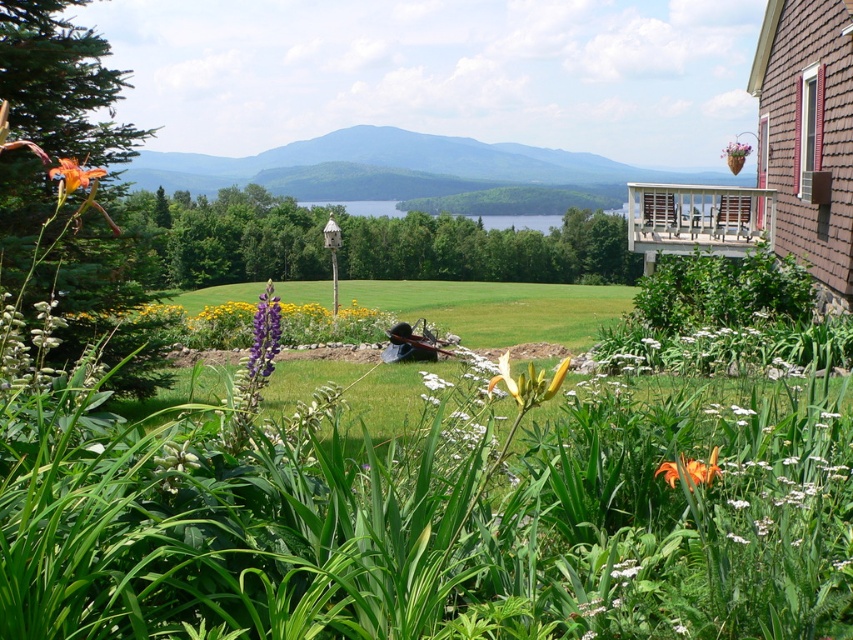
Between point (149, 618) and point (717, 212), which one is positioned behind?

The point (717, 212) is behind.

Can you confirm if green leafy plants at center is positioned below wooden deck at upper right?

Correct, green leafy plants at center is located below wooden deck at upper right.

Is point (581, 545) closer to camera compared to point (767, 198)?

Yes, it is in front of point (767, 198).

Where is `green leafy plants at center`? The image size is (853, 640). green leafy plants at center is located at coordinates (428, 515).

Between wooden deck at upper right and matte plastic hanging basket at upper right, which one appears on the right side from the viewer's perspective?

matte plastic hanging basket at upper right is more to the right.

Which of these two, wooden deck at upper right or matte plastic hanging basket at upper right, stands shorter?

wooden deck at upper right is shorter.

Measure the distance between point (761,214) and camera.

Point (761,214) and camera are 18.47 meters apart.

Where is `wooden deck at upper right`? This screenshot has height=640, width=853. wooden deck at upper right is located at coordinates (698, 218).

Is yellow matte flower at center smaller than matte plastic hanging basket at upper right?

Yes.

Which is more to the right, yellow matte flower at center or matte plastic hanging basket at upper right?

matte plastic hanging basket at upper right is more to the right.

Identify the location of yellow matte flower at center. The height and width of the screenshot is (640, 853). pos(527,381).